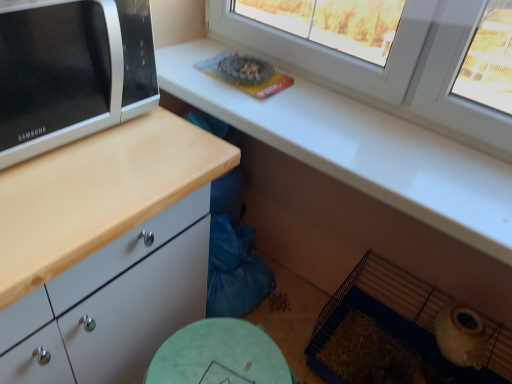
Question: Visually, is white plastic window at upper center positioned to the left or to the right of white glossy microwave at left?

Choices:
 (A) right
 (B) left

Answer: (A)

Question: From a real-world perspective, relative to white glossy microwave at left, is white plastic window at upper center vertically above or below?

Choices:
 (A) below
 (B) above

Answer: (A)

Question: From the image's perspective, is white plastic window at upper center located above or below white glossy microwave at left?

Choices:
 (A) below
 (B) above

Answer: (B)

Question: Is white glossy microwave at left spatially inside white plastic window at upper center, or outside of it?

Choices:
 (A) outside
 (B) inside

Answer: (A)

Question: Looking at the image, does white glossy microwave at left seem bigger or smaller compared to white plastic window at upper center?

Choices:
 (A) small
 (B) big

Answer: (B)

Question: Considering the positions of point (14, 29) and point (450, 23), is point (14, 29) closer or farther from the camera than point (450, 23)?

Choices:
 (A) closer
 (B) farther

Answer: (A)

Question: From their relative heights in the image, would you say white glossy microwave at left is taller or shorter than white plastic window at upper center?

Choices:
 (A) tall
 (B) short

Answer: (B)